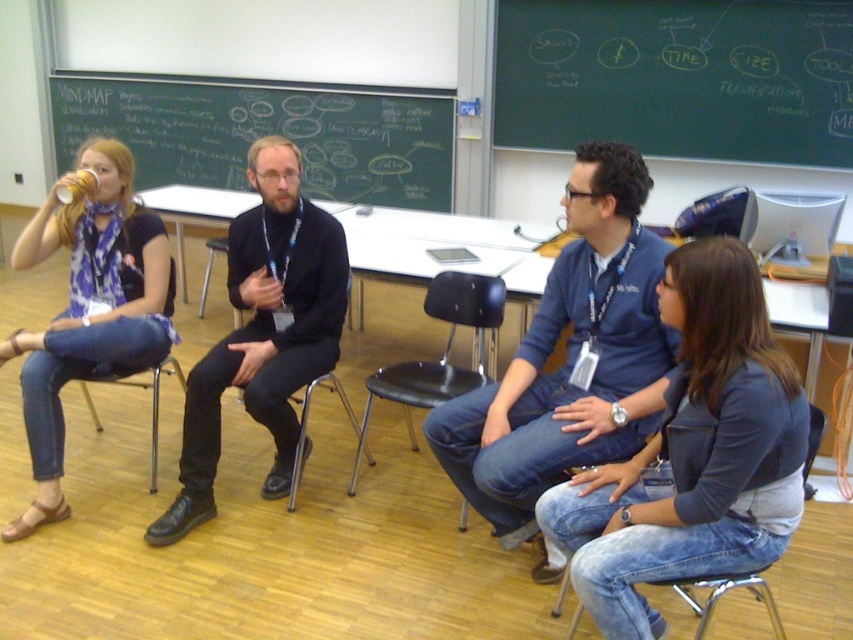
You are sitting in the classroom and want to move from your current position to the door located behind the metallic silver chair at center. Can you easily walk around the blue denim jeans at center to reach the door?

The blue denim jeans at center is in front of the metallic silver chair at center, so you can walk around the blue denim jeans at center to reach the door behind the metallic silver chair at center.

You are standing in the classroom and want to place a small plant between the denim jeans at lower right and the black chalkboard at upper left. Is the space between them suitable for placing the plant?

The denim jeans at lower right is positioned under the black chalkboard at upper left, so there is vertical space between them. However, since the plant is small, it can be placed in the space between them.